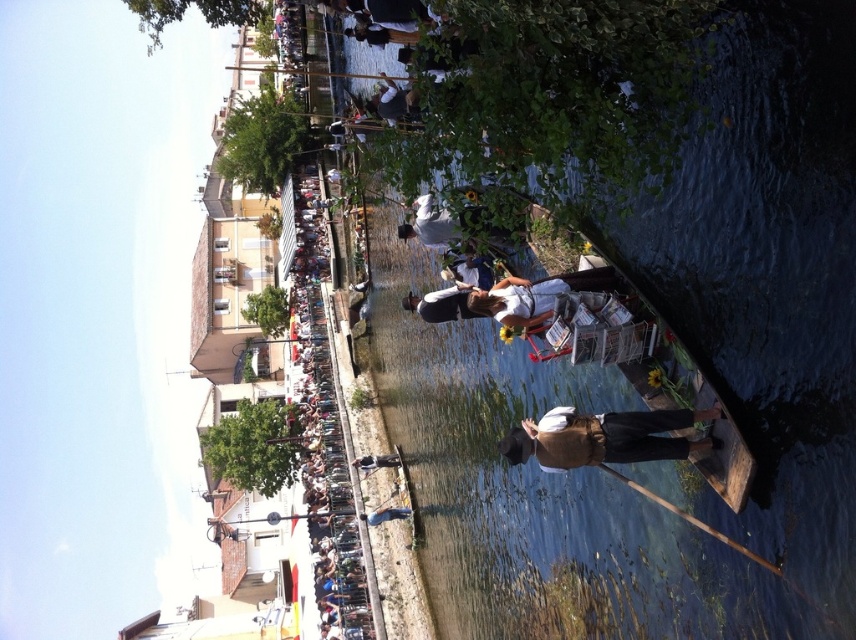
You are standing at the edge of the canal and want to take a photo. There are two points marked in the image, point 1 at coordinates point (699, 582) and point 2 at coordinates point (635, 419). Which point is closer to your camera position?

Point 2 at coordinates point (635, 419) is closer to the camera position because it is less further away than point 1 at coordinates point (699, 582).

You are a photographer trying to capture the scene by the canal. You want to ensure that both the clear blue water at center and the brown leather hat at center are visible in your shot. Based on their positions, which object should you focus on first to frame them properly?

The clear blue water at center is positioned on the left side of brown leather hat at center, so you should focus on the brown leather hat at center first to frame both objects properly.

You are a boat operator who needs to navigate a 3.5 meter long boat through the canal. The boat must pass between the clear blue water at center and the brown leather hat at center. Can the boat fit through the gap? Explain your reasoning.

The distance between the clear blue water at center and the brown leather hat at center is 9.58 meters. Since the boat is 3.5 meters long, it can easily fit through the gap as the distance is more than sufficient for the boat to pass.